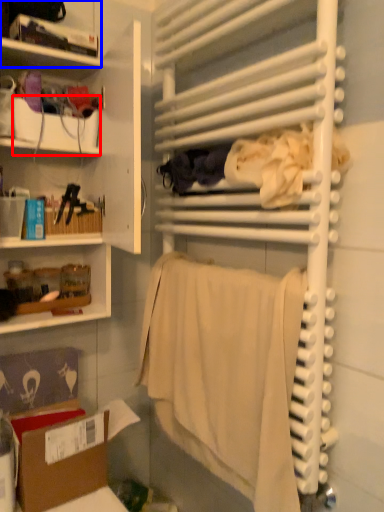
Question: Which of the following is the farthest to the observer, box (highlighted by a red box) or shelf (highlighted by a blue box)?

Choices:
 (A) box
 (B) shelf

Answer: (A)